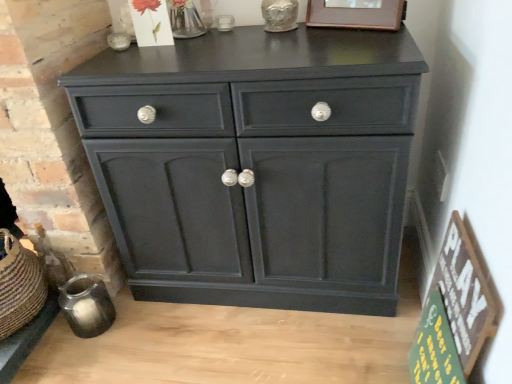
This screenshot has width=512, height=384. I want to click on matte black cabinet at center, so click(x=256, y=165).

Find the location of a particular element. wooden picture frame at upper center is located at coordinates (356, 14).

Locate an element on the screen. green wood sign at lower right, positioned as the first bulletin board in bottom-to-top order is located at coordinates (434, 347).

Considering the sizes of objects matte black cabinet at center and green wood sign at lower right, the 2th bulletin board viewed from the top, in the image provided, who is wider, matte black cabinet at center or green wood sign at lower right, the 2th bulletin board viewed from the top,?

Wider between the two is matte black cabinet at center.

Is there a large distance between matte black cabinet at center and green wood sign at lower right, the 2th bulletin board viewed from the top?

matte black cabinet at center is actually quite close to green wood sign at lower right, the 2th bulletin board viewed from the top.

I want to click on chest of drawers behind the green wood sign at lower right, the 2th bulletin board viewed from the top, so click(256, 165).

In the image, is wooden picture frame at upper center positioned in front of or behind green wood sign at lower right, the 2th bulletin board viewed from the top?

In the image, wooden picture frame at upper center appears behind green wood sign at lower right, the 2th bulletin board viewed from the top.

Is wooden picture frame at upper center beside green wood sign at lower right, positioned as the first bulletin board in bottom-to-top order?

wooden picture frame at upper center is not next to green wood sign at lower right, positioned as the first bulletin board in bottom-to-top order, and they're not touching.

Looking at their sizes, would you say wooden picture frame at upper center is wider or thinner than green wood sign at lower right, positioned as the first bulletin board in bottom-to-top order?

Clearly, wooden picture frame at upper center has less width compared to green wood sign at lower right, positioned as the first bulletin board in bottom-to-top order.

Is wooden sign at lower right, the 1th bulletin board viewed from the top, inside or outside of wooden picture frame at upper center?

wooden sign at lower right, the 1th bulletin board viewed from the top, is not inside wooden picture frame at upper center, it's outside.

Which of these two, wooden sign at lower right, the 1th bulletin board viewed from the top, or wooden picture frame at upper center, is bigger?

wooden sign at lower right, the 1th bulletin board viewed from the top.

Which object is wider, wooden sign at lower right, the 1th bulletin board viewed from the top, or wooden picture frame at upper center?

Wider between the two is wooden picture frame at upper center.

Which bulletin board is the 2nd one when counting from the front of the wooden picture frame at upper center? Please provide its 2D coordinates.

[(464, 292)]

Who is smaller, wooden picture frame at upper center or matte black cabinet at center?

wooden picture frame at upper center is smaller.

Does wooden picture frame at upper center turn towards matte black cabinet at center?

No, wooden picture frame at upper center does not turn towards matte black cabinet at center.

Is wooden picture frame at upper center not within matte black cabinet at center?

Indeed, wooden picture frame at upper center is completely outside matte black cabinet at center.

What are the coordinates of `chest of drawers in front of the wooden picture frame at upper center` in the screenshot? It's located at (256, 165).

Is the depth of wooden picture frame at upper center greater than that of wooden sign at lower right, the 1th bulletin board viewed from the top?

That is True.

Can you tell me how much wooden picture frame at upper center and wooden sign at lower right, the 2th bulletin board in the bottom-to-top sequence, differ in facing direction?

The angular difference between wooden picture frame at upper center and wooden sign at lower right, the 2th bulletin board in the bottom-to-top sequence, is 63.7 degrees.

Can you confirm if wooden picture frame at upper center is smaller than wooden sign at lower right, the 2th bulletin board in the bottom-to-top sequence?

Yes.

Where is `picture frame behind the wooden sign at lower right, the 1th bulletin board viewed from the top`? Image resolution: width=512 pixels, height=384 pixels. picture frame behind the wooden sign at lower right, the 1th bulletin board viewed from the top is located at coordinates (356, 14).

Locate an element on the screen. chest of drawers above the wooden sign at lower right, the 2th bulletin board in the bottom-to-top sequence (from the image's perspective) is located at coordinates (256, 165).

Which is more to the right, matte black cabinet at center or wooden sign at lower right, the 2th bulletin board in the bottom-to-top sequence?

From the viewer's perspective, wooden sign at lower right, the 2th bulletin board in the bottom-to-top sequence, appears more on the right side.

Locate an element on the screen. The height and width of the screenshot is (384, 512). bulletin board on the right of green wood sign at lower right, the 2th bulletin board viewed from the top is located at coordinates (464, 292).

Would you say wooden sign at lower right, the 1th bulletin board viewed from the top, is part of green wood sign at lower right, the 2th bulletin board viewed from the top,'s contents?

Yes, wooden sign at lower right, the 1th bulletin board viewed from the top, is a part of green wood sign at lower right, the 2th bulletin board viewed from the top.

Relative to wooden sign at lower right, the 2th bulletin board in the bottom-to-top sequence, is green wood sign at lower right, the 2th bulletin board viewed from the top, in front or behind?

In the image, green wood sign at lower right, the 2th bulletin board viewed from the top, appears behind wooden sign at lower right, the 2th bulletin board in the bottom-to-top sequence.

How far apart are green wood sign at lower right, positioned as the first bulletin board in bottom-to-top order, and wooden sign at lower right, the 1th bulletin board viewed from the top?

They are 10.57 centimeters apart.

Locate an element on the screen. The image size is (512, 384). the 1st bulletin board in front of the matte black cabinet at center, counting from the anchor's position is located at coordinates (434, 347).

This screenshot has height=384, width=512. I want to click on the 1st bulletin board counting from the right of the wooden picture frame at upper center, so click(x=434, y=347).

Based on their spatial positions, is wooden picture frame at upper center or matte black cabinet at center closer to wooden sign at lower right, the 1th bulletin board viewed from the top?

Among the two, matte black cabinet at center is located nearer to wooden sign at lower right, the 1th bulletin board viewed from the top.

Looking at the image, which one is located closer to wooden sign at lower right, the 1th bulletin board viewed from the top, matte black cabinet at center or green wood sign at lower right, positioned as the first bulletin board in bottom-to-top order?

green wood sign at lower right, positioned as the first bulletin board in bottom-to-top order, is positioned closer to the anchor wooden sign at lower right, the 1th bulletin board viewed from the top.

From the image, which object appears to be nearer to matte black cabinet at center, wooden picture frame at upper center or wooden sign at lower right, the 2th bulletin board in the bottom-to-top sequence?

The object closer to matte black cabinet at center is wooden sign at lower right, the 2th bulletin board in the bottom-to-top sequence.

Which object lies further to the anchor point green wood sign at lower right, the 2th bulletin board viewed from the top, wooden sign at lower right, the 1th bulletin board viewed from the top, or matte black cabinet at center?

matte black cabinet at center.

Based on their spatial positions, is wooden picture frame at upper center or green wood sign at lower right, the 2th bulletin board viewed from the top, further from wooden sign at lower right, the 2th bulletin board in the bottom-to-top sequence?

wooden picture frame at upper center lies further to wooden sign at lower right, the 2th bulletin board in the bottom-to-top sequence, than the other object.

Looking at the image, which one is located further to wooden picture frame at upper center, wooden sign at lower right, the 1th bulletin board viewed from the top, or green wood sign at lower right, the 2th bulletin board viewed from the top?

green wood sign at lower right, the 2th bulletin board viewed from the top.

Considering their positions, is wooden sign at lower right, the 2th bulletin board in the bottom-to-top sequence, positioned closer to matte black cabinet at center than green wood sign at lower right, positioned as the first bulletin board in bottom-to-top order?

Based on the image, wooden sign at lower right, the 2th bulletin board in the bottom-to-top sequence, appears to be nearer to matte black cabinet at center.

From the image, which object appears to be farther from green wood sign at lower right, the 2th bulletin board viewed from the top, matte black cabinet at center or wooden picture frame at upper center?

wooden picture frame at upper center is further to green wood sign at lower right, the 2th bulletin board viewed from the top.

Find the location of a particular element. This screenshot has width=512, height=384. chest of drawers between wooden picture frame at upper center and wooden sign at lower right, the 1th bulletin board viewed from the top, in the vertical direction is located at coordinates (256, 165).

Identify the location of bulletin board between wooden picture frame at upper center and green wood sign at lower right, the 2th bulletin board viewed from the top, vertically. (464, 292).

What are the coordinates of `chest of drawers between wooden picture frame at upper center and green wood sign at lower right, positioned as the first bulletin board in bottom-to-top order, from top to bottom` in the screenshot? It's located at (256, 165).

I want to click on bulletin board between matte black cabinet at center and green wood sign at lower right, positioned as the first bulletin board in bottom-to-top order, vertically, so click(464, 292).